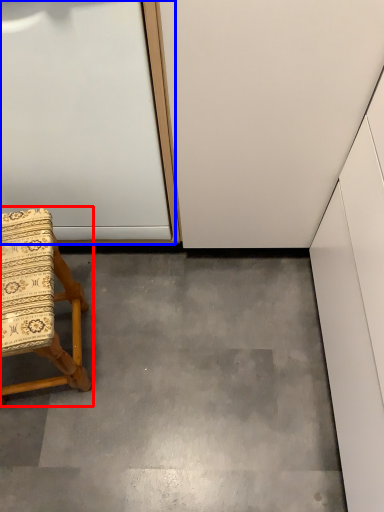
Question: Which object appears farthest to the camera in this image, chair (highlighted by a red box) or door (highlighted by a blue box)?

Choices:
 (A) chair
 (B) door

Answer: (A)